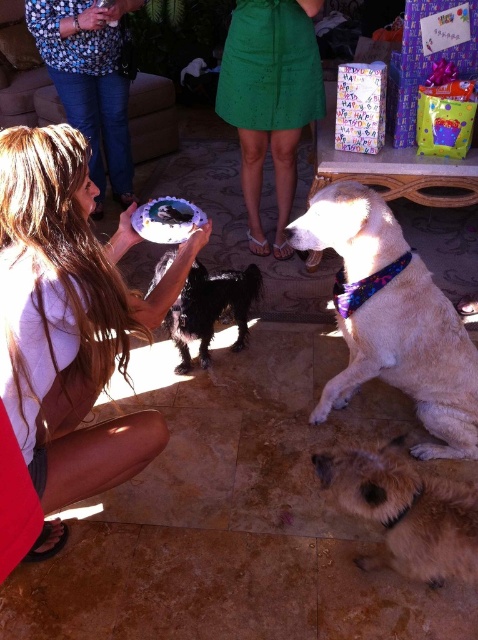
Question: Which point appears farthest from the camera in this image?

Choices:
 (A) (112, 10)
 (B) (84, 140)

Answer: (A)

Question: Which is farther from the matte white plate at center?

Choices:
 (A) light brown fur at lower right
 (B) black fur dog at center
 (C) white paper plate at center
 (D) light brown fur at center

Answer: (D)

Question: Which object is closer to the camera taking this photo?

Choices:
 (A) matte white plate at center
 (B) white paper plate at center

Answer: (A)

Question: Does black fur dog at center appear on the right side of white paper plate at center?

Choices:
 (A) no
 (B) yes

Answer: (B)

Question: Can you confirm if light brown fur at center is positioned to the left of green fabric skirt at center?

Choices:
 (A) yes
 (B) no

Answer: (B)

Question: Does light brown fur at center appear under white paper plate at center?

Choices:
 (A) no
 (B) yes

Answer: (B)